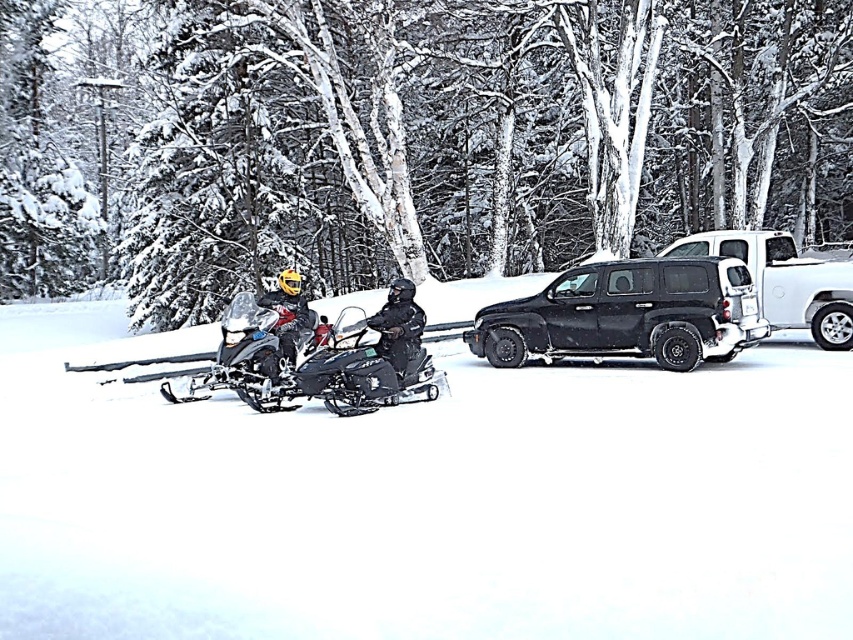
Question: Which is nearer to the white glossy trailer truck at center right?

Choices:
 (A) shiny silver snowmobile at center
 (B) matte black snowmobile at center

Answer: (A)

Question: Can you confirm if black matte snowmobile at center is thinner than matte black snowmobile at center?

Choices:
 (A) yes
 (B) no

Answer: (A)

Question: Which point is farther to the camera?

Choices:
 (A) (410, 349)
 (B) (778, 216)
 (C) (381, 380)

Answer: (B)

Question: Can you confirm if white glossy trailer truck at center right is positioned to the right of matte black snowmobile at center?

Choices:
 (A) no
 (B) yes

Answer: (B)

Question: Which object is farther from the camera taking this photo?

Choices:
 (A) white glossy trailer truck at center right
 (B) black matte suv at center
 (C) matte black snowmobile at center

Answer: (A)

Question: Does shiny black snowmobile at center have a smaller size compared to matte black snowmobile at center?

Choices:
 (A) yes
 (B) no

Answer: (A)